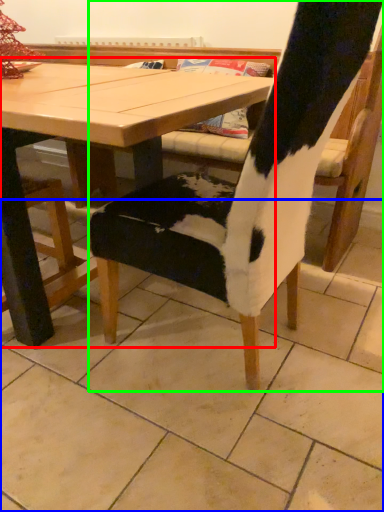
Question: Considering the real-world distances, which object is closest to table (highlighted by a red box)? tile (highlighted by a blue box) or chair (highlighted by a green box).

Choices:
 (A) tile
 (B) chair

Answer: (B)